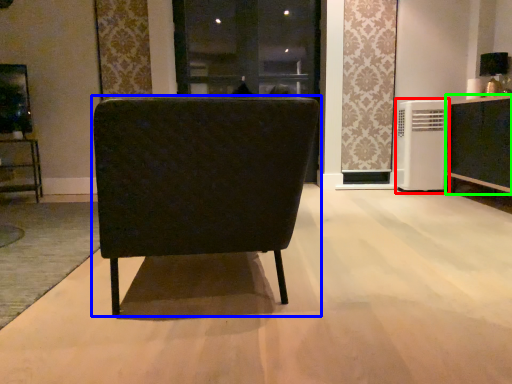
Question: Which is farther away from air conditioner (highlighted by a red box)? chair (highlighted by a blue box) or cabinetry (highlighted by a green box)?

Choices:
 (A) chair
 (B) cabinetry

Answer: (A)